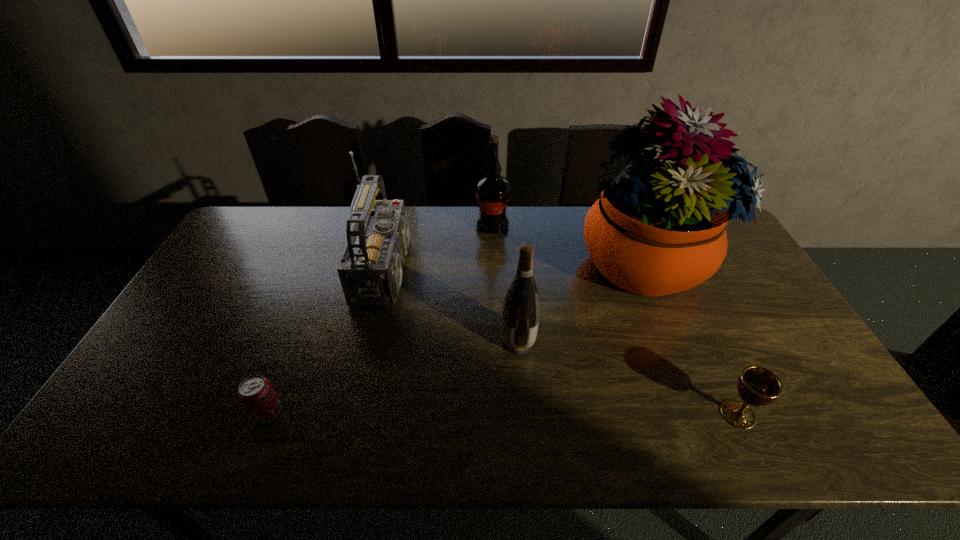
Find the location of `free space located on the label of the fourth farthest object`. free space located on the label of the fourth farthest object is located at coordinates (432, 342).

Find the location of a particular element. Image resolution: width=960 pixels, height=540 pixels. free space located 0.240m on the label of the fourth farthest object is located at coordinates (414, 342).

You are a GUI agent. You are given a task and a screenshot of the screen. Output one action in this format:
    pyautogui.click(x=<x>, y=<y>)
    Task: Click on the free spot located on the label of the fourth farthest object
    The height and width of the screenshot is (540, 960).
    Given the screenshot: What is the action you would take?
    pyautogui.click(x=446, y=342)

I want to click on vacant space located on the right of the chalice, so click(x=831, y=414).

Identify the location of free space located on the right of the soda. (362, 413).

This screenshot has height=540, width=960. In order to click on flower arrangement that is at the far edge in this screenshot , I will do `click(658, 228)`.

The height and width of the screenshot is (540, 960). I want to click on wine bottle positioned at the far edge, so click(492, 191).

I want to click on radio receiver that is at the far edge, so click(x=370, y=270).

Where is `chalice at the near edge`? This screenshot has width=960, height=540. chalice at the near edge is located at coordinates (757, 386).

The height and width of the screenshot is (540, 960). I want to click on soda that is at the near edge, so click(257, 395).